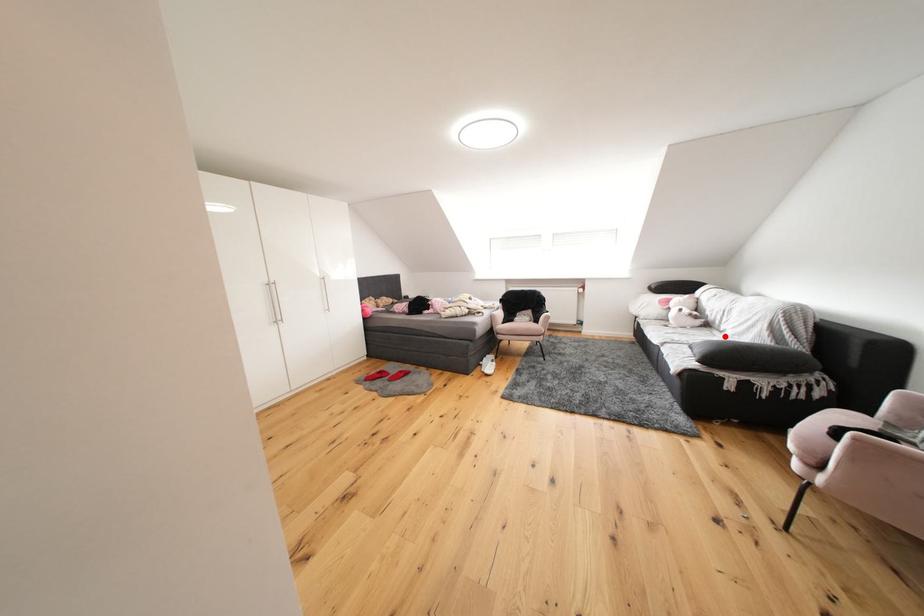
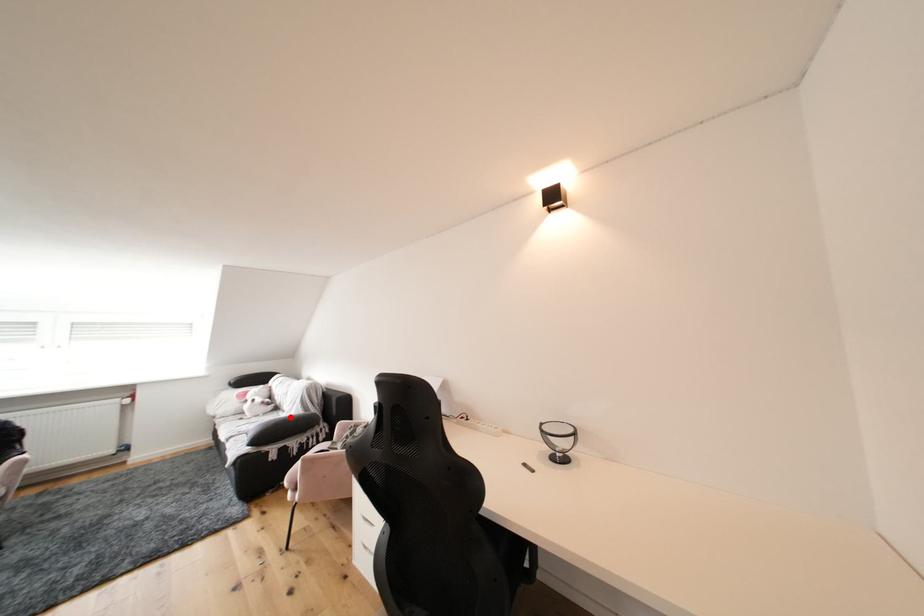
I am providing you with two images of the same scene from different viewpoints. A red point is marked on the first image and another point is marked on the second image. Are the points marked in image1 and image2 representing the same 3D position?

Yes